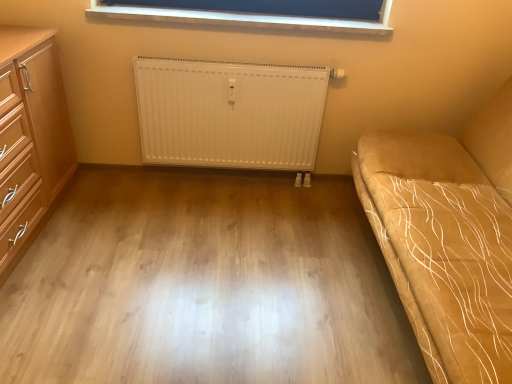
What do you see at coordinates (230, 114) in the screenshot?
I see `white ribbed radiator at center` at bounding box center [230, 114].

Image resolution: width=512 pixels, height=384 pixels. What do you see at coordinates (30, 137) in the screenshot? I see `light wood/wooden chest of drawers at left` at bounding box center [30, 137].

The width and height of the screenshot is (512, 384). Identify the location of blue fabric at upper center. (256, 14).

Is light wood/wooden chest of drawers at left touching light wood floor at center?

They are not placed beside each other.

Considering the sizes of objects light wood/wooden chest of drawers at left and light wood floor at center in the image provided, who is smaller, light wood/wooden chest of drawers at left or light wood floor at center?

light wood floor at center is smaller.

Looking at this image, does light wood/wooden chest of drawers at left have a greater width compared to light wood floor at center?

No, light wood/wooden chest of drawers at left is not wider than light wood floor at center.

Locate an element on the screen. chest of drawers above the light wood floor at center (from the image's perspective) is located at coordinates (30, 137).

Which object is closer to the camera taking this photo, light wood/wooden chest of drawers at left or blue fabric at upper center?

light wood/wooden chest of drawers at left is more forward.

From a real-world perspective, between light wood/wooden chest of drawers at left and blue fabric at upper center, who is vertically lower?

In real-world perspective, light wood/wooden chest of drawers at left is lower.

Is light wood/wooden chest of drawers at left turned away from blue fabric at upper center?

No, light wood/wooden chest of drawers at left is not facing the opposite direction of blue fabric at upper center.

Which of these two, light wood floor at center or white ribbed radiator at center, is smaller?

white ribbed radiator at center.

From a real-world perspective, who is located lower, light wood floor at center or white ribbed radiator at center?

In real-world perspective, light wood floor at center is lower.

From the image's perspective, is light wood floor at center under white ribbed radiator at center?

Yes, from the image's perspective, light wood floor at center is beneath white ribbed radiator at center.

From a real-world perspective, which object stands above the other?

suede-like beige studio couch at right, from a real-world perspective.

Is suede-like beige studio couch at right completely or partially outside of light wood floor at center?

suede-like beige studio couch at right lies outside light wood floor at center's area.

You are a GUI agent. You are given a task and a screenshot of the screen. Output one action in this format:
    pyautogui.click(x=<x>, y=<y>)
    Task: Click on the plain that appears behind the suede-like beige studio couch at right
    
    Given the screenshot: What is the action you would take?
    pyautogui.click(x=205, y=285)

How far apart are suede-like beige studio couch at right and light wood floor at center?

A distance of 25.98 inches exists between suede-like beige studio couch at right and light wood floor at center.

Is light wood/wooden chest of drawers at left facing towards white ribbed radiator at center?

Yes, light wood/wooden chest of drawers at left is facing white ribbed radiator at center.

Consider the image. Is light wood/wooden chest of drawers at left outside of white ribbed radiator at center?

Indeed, light wood/wooden chest of drawers at left is completely outside white ribbed radiator at center.

Is light wood/wooden chest of drawers at left positioned behind white ribbed radiator at center?

No, it is in front of white ribbed radiator at center.

Considering the sizes of objects blue fabric at upper center and light wood floor at center in the image provided, who is thinner, blue fabric at upper center or light wood floor at center?

Thinner between the two is blue fabric at upper center.

From the image's perspective, relative to light wood floor at center, is blue fabric at upper center above or below?

blue fabric at upper center is above light wood floor at center.

Is there a large distance between blue fabric at upper center and light wood floor at center?

That's right, there is a large distance between blue fabric at upper center and light wood floor at center.

Can suede-like beige studio couch at right be found inside light wood floor at center?

Actually, suede-like beige studio couch at right is outside light wood floor at center.

Between light wood floor at center and suede-like beige studio couch at right, which one has larger size?

suede-like beige studio couch at right is bigger.

Who is taller, light wood floor at center or suede-like beige studio couch at right?

suede-like beige studio couch at right.

Identify the location of plain below the light wood/wooden chest of drawers at left (from the image's perspective). This screenshot has width=512, height=384. (205, 285).

You are a GUI agent. You are given a task and a screenshot of the screen. Output one action in this format:
    pyautogui.click(x=<x>, y=<y>)
    Task: Click on the window located on the right of light wood/wooden chest of drawers at left
    
    Given the screenshot: What is the action you would take?
    pyautogui.click(x=256, y=14)

Looking at the image, which one is located further to light wood floor at center, blue fabric at upper center or white ribbed radiator at center?

The object further to light wood floor at center is blue fabric at upper center.

From the picture: When comparing their distances from white ribbed radiator at center, does light wood floor at center or light wood/wooden chest of drawers at left seem further?

Among the two, light wood/wooden chest of drawers at left is located further to white ribbed radiator at center.

Looking at the image, which one is located closer to light wood/wooden chest of drawers at left, blue fabric at upper center or white ribbed radiator at center?

Among the two, white ribbed radiator at center is located nearer to light wood/wooden chest of drawers at left.

From the image, which object appears to be nearer to light wood/wooden chest of drawers at left, light wood floor at center or suede-like beige studio couch at right?

Result: light wood floor at center is positioned closer to the anchor light wood/wooden chest of drawers at left.

Which object lies further to the anchor point light wood floor at center, suede-like beige studio couch at right or blue fabric at upper center?

blue fabric at upper center lies further to light wood floor at center than the other object.

Considering their positions, is suede-like beige studio couch at right positioned closer to white ribbed radiator at center than blue fabric at upper center?

blue fabric at upper center is closer to white ribbed radiator at center.

Which object lies further to the anchor point suede-like beige studio couch at right, blue fabric at upper center or light wood floor at center?

blue fabric at upper center is further to suede-like beige studio couch at right.

Which object lies nearer to the anchor point white ribbed radiator at center, blue fabric at upper center or light wood/wooden chest of drawers at left?

blue fabric at upper center is positioned closer to the anchor white ribbed radiator at center.

Image resolution: width=512 pixels, height=384 pixels. Identify the location of plain between light wood/wooden chest of drawers at left and suede-like beige studio couch at right from left to right. (205, 285).

Locate an element on the screen. This screenshot has width=512, height=384. plain between light wood/wooden chest of drawers at left and white ribbed radiator at center is located at coordinates (205, 285).

Image resolution: width=512 pixels, height=384 pixels. Identify the location of plain located between suede-like beige studio couch at right and blue fabric at upper center in the depth direction. (205, 285).

Find the location of a particular element. The width and height of the screenshot is (512, 384). window positioned between suede-like beige studio couch at right and white ribbed radiator at center from near to far is located at coordinates (256, 14).